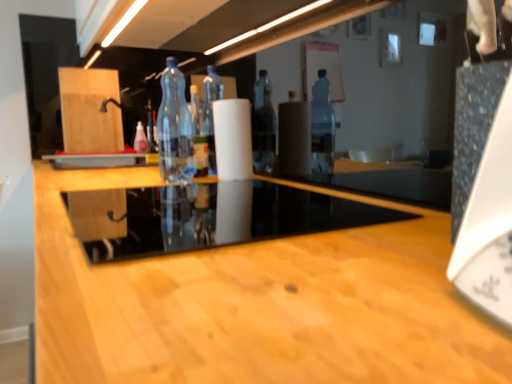
Question: Looking at their shapes, would you say transparent glass table at center is wider or thinner than pink plastic bottle at center, marked as the 2th bottle in a right-to-left arrangement?

Choices:
 (A) thin
 (B) wide

Answer: (B)

Question: Looking at the image, does transparent glass table at center seem bigger or smaller compared to pink plastic bottle at center, the first bottle from the back?

Choices:
 (A) small
 (B) big

Answer: (B)

Question: Estimate the real-world distances between objects in this image. Which object is closer to the transparent glass table at center?

Choices:
 (A) transparent plastic bottle at center, placed as the second bottle when sorted from left to right
 (B) pink plastic bottle at center, the first bottle from the back
 (C) white matte paper towel at center

Answer: (C)

Question: Which of these objects is positioned farthest from the transparent plastic bottle at center, placed as the second bottle when sorted from left to right?

Choices:
 (A) transparent glass table at center
 (B) pink plastic bottle at center, the first bottle from the left
 (C) white matte paper towel at center

Answer: (B)